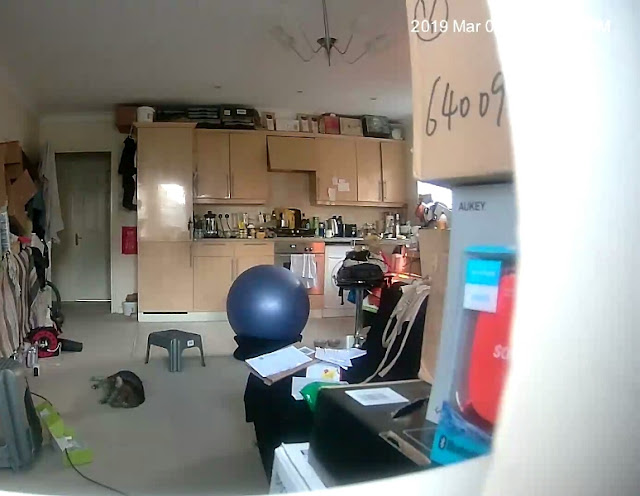
Find the location of a particular element. The width and height of the screenshot is (640, 496). white dish rag is located at coordinates pyautogui.click(x=304, y=265).